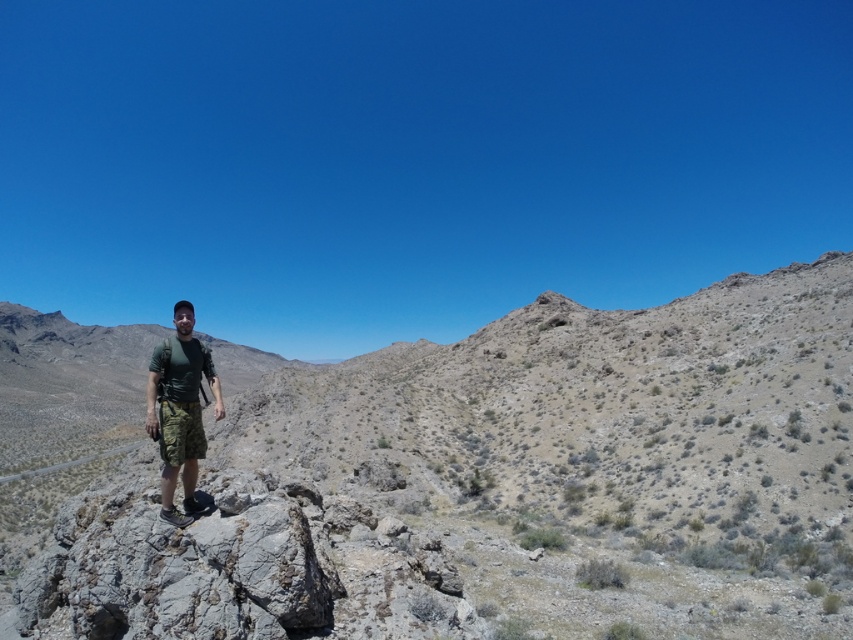
Which is more to the left, gray rocky mountain at center or green camouflage shorts at center?

gray rocky mountain at center is more to the left.

Who is positioned more to the right, gray rocky mountain at center or green camouflage shorts at center?

Positioned to the right is green camouflage shorts at center.

Does point (91, 611) lie in front of point (165, 493)?

Yes, it is in front of point (165, 493).

Locate an element on the screen. The height and width of the screenshot is (640, 853). gray rocky mountain at center is located at coordinates (491, 486).